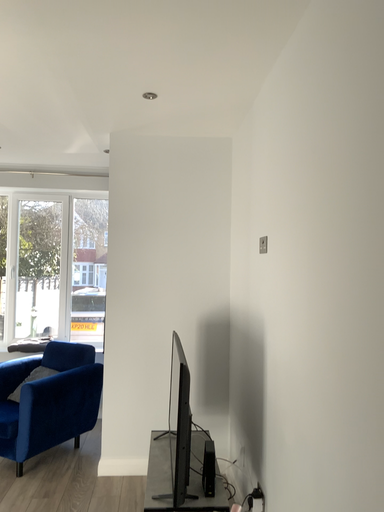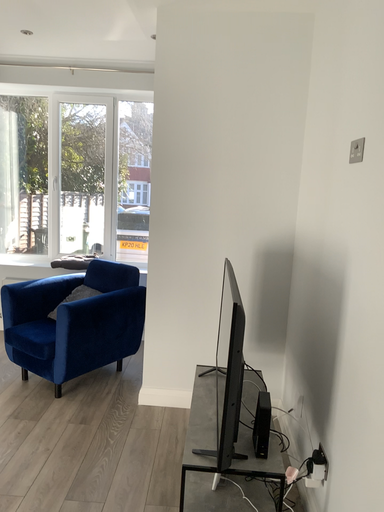
Question: How did the camera likely rotate when shooting the video?

Choices:
 (A) rotated downward
 (B) rotated upward

Answer: (A)